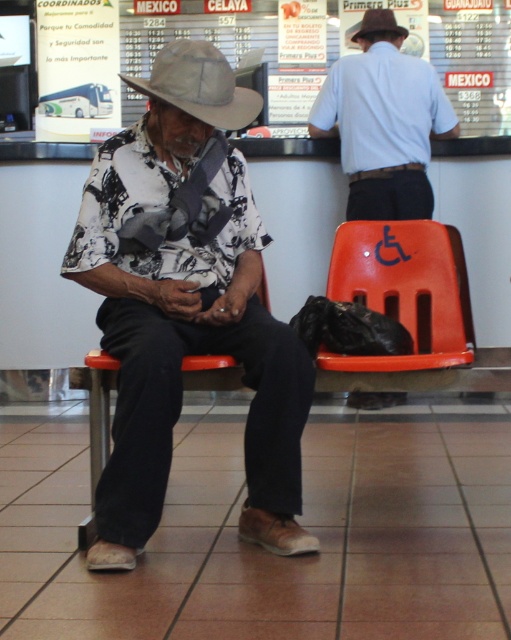
You are a traveler carrying a large backpack and need to sit down. You see an orange plastic chair at center and a woven straw hat at left. Which one has more space to accommodate your backpack?

The orange plastic chair at center has more space to accommodate your backpack since its width surpasses that of the woven straw hat at left.